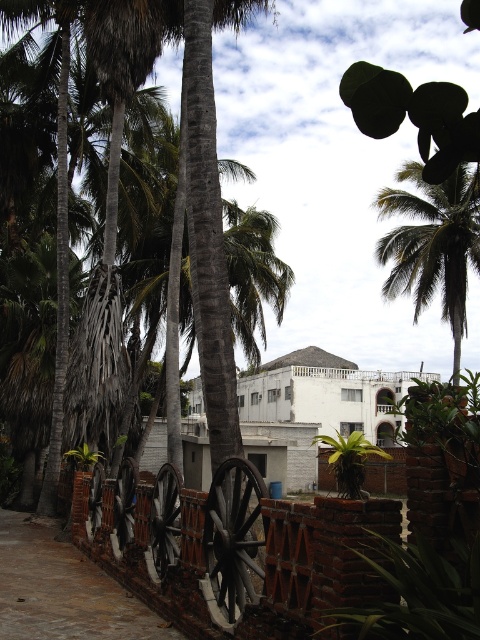
Between green leafy palm tree at upper right and brick wall at center, which one is positioned higher?

Positioned higher is green leafy palm tree at upper right.

Between point (398, 205) and point (320, 452), which one is positioned behind?

Positioned behind is point (320, 452).

Is point (443, 241) farther from camera compared to point (382, 474)?

No, (443, 241) is closer to viewer.

Find the location of a particular element. green leafy palm tree at upper right is located at coordinates (432, 243).

Between rustic wood wagon at center and brick wall at center, which one appears on the right side from the viewer's perspective?

brick wall at center is more to the right.

How far apart are rustic wood wagon at center and brick wall at center?

rustic wood wagon at center is 92.57 feet from brick wall at center.

I want to click on rustic wood wagon at center, so (x=179, y=540).

Can you confirm if wooden wheels at lower center is shorter than brick wall at center?

Indeed, wooden wheels at lower center has a lesser height compared to brick wall at center.

Who is more forward, (x=0, y=564) or (x=324, y=490)?

Point (x=0, y=564)

Identify the location of wooden wheels at lower center. The height and width of the screenshot is (640, 480). (62, 589).